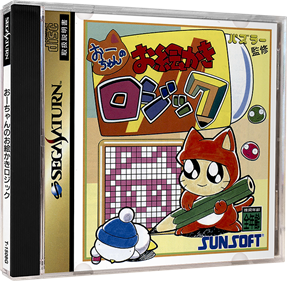
At what (x,y) coordinates should I click in order to perform the action: click on 2 pencils. Please return your answer as a coordinate pair (x, y). The image size is (287, 281). Looking at the image, I should click on (214, 93), (197, 219).